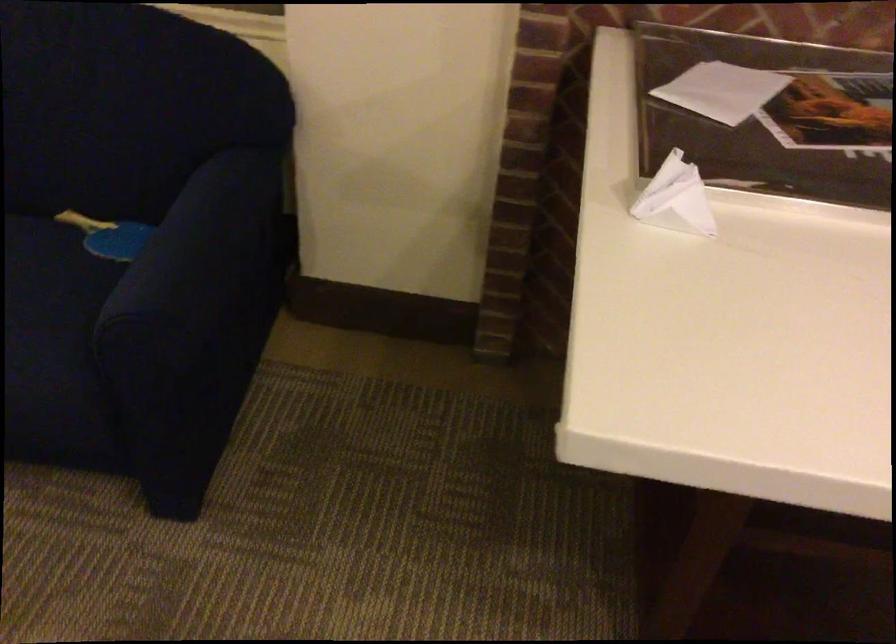
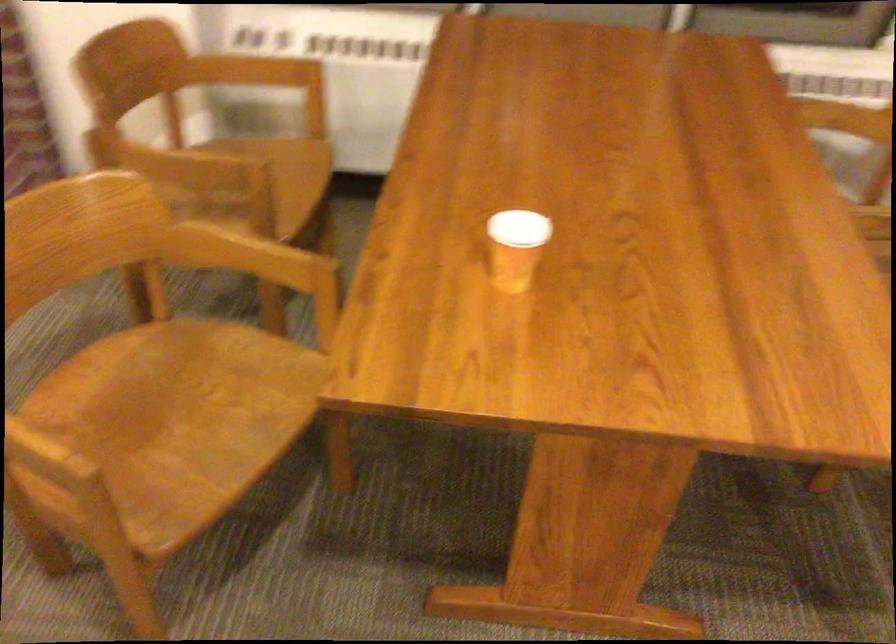
Question: Which direction would the cameraman need to move to produce the second image? Reply with the corresponding letter.

Choices:
 (A) Left
 (B) Right
 (C) Forward
 (D) Backward

Answer: (B)